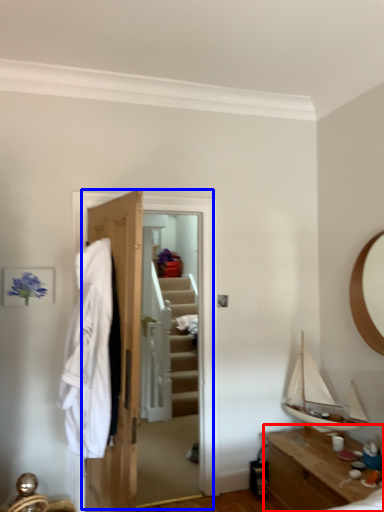
Question: Which object is closer to the camera taking this photo, table (highlighted by a red box) or closet (highlighted by a blue box)?

Choices:
 (A) table
 (B) closet

Answer: (A)